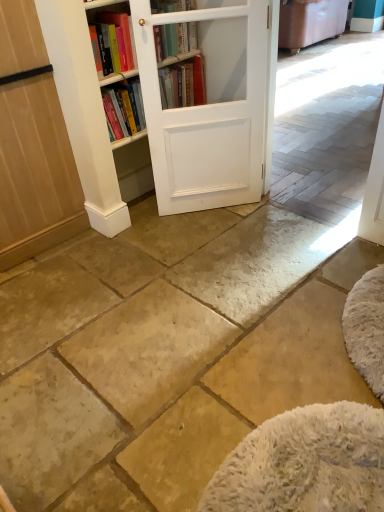
You are a GUI agent. You are given a task and a screenshot of the screen. Output one action in this format:
    pyautogui.click(x=<x>, y=<y>)
    Task: Click on the spots to the right of white matte barn door at center
    The image size is (384, 512).
    Given the screenshot: What is the action you would take?
    pyautogui.click(x=261, y=219)